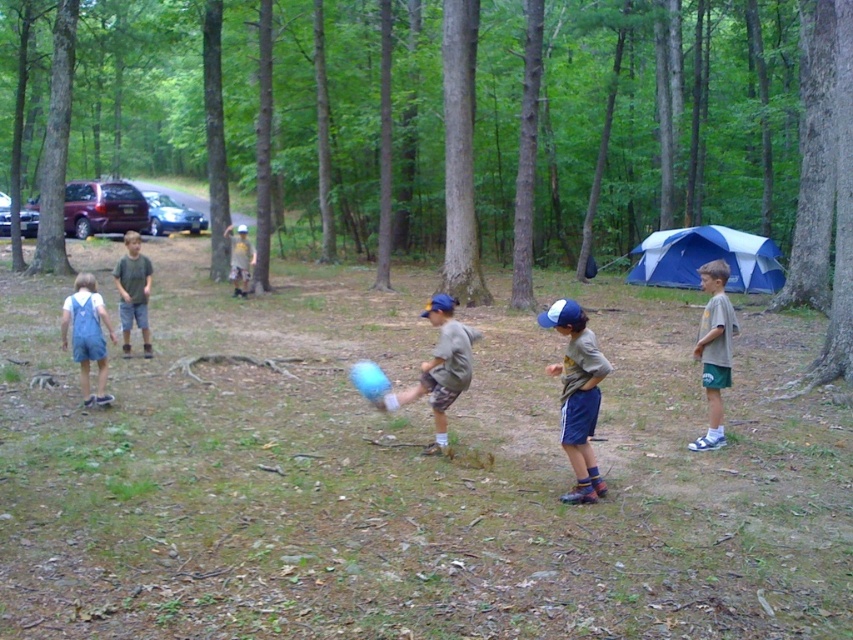
Question: Based on their relative distances, which object is farther from the gray cotton shirt at right?

Choices:
 (A) light brown shorts at center
 (B) light brown wooden stick at upper center

Answer: (B)

Question: Which object is closer to the camera taking this photo?

Choices:
 (A) blue fabric cap at center
 (B) gray cotton shirt at right
 (C) matte gray shirt at center
 (D) light brown shorts at center

Answer: (A)

Question: Which point is closer to the camera?

Choices:
 (A) gray cotton shirt at right
 (B) light brown shorts at center
 (C) light brown wooden stick at upper center

Answer: (A)

Question: Does blue fabric cap at center lie in front of light brown wooden stick at upper center?

Choices:
 (A) no
 (B) yes

Answer: (B)

Question: Is blue fabric cap at center to the left of denim overalls at left from the viewer's perspective?

Choices:
 (A) no
 (B) yes

Answer: (A)

Question: Can you confirm if matte gray shirt at center is positioned to the right of light brown shorts at center?

Choices:
 (A) no
 (B) yes

Answer: (B)